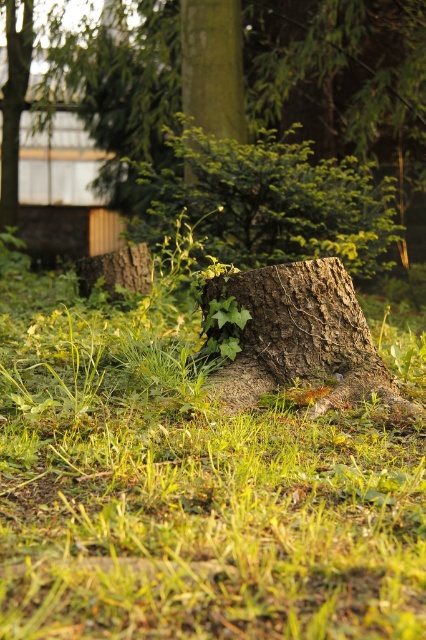
Question: Considering the relative positions of green grass at center and green mossy bark at center in the image provided, where is green grass at center located with respect to green mossy bark at center?

Choices:
 (A) left
 (B) right

Answer: (A)

Question: Which is nearer to the smooth brown stump at center?

Choices:
 (A) green mossy bark at center
 (B) green grass at center

Answer: (A)

Question: Is green grass at center thinner than green mossy bark at center?

Choices:
 (A) no
 (B) yes

Answer: (A)

Question: Considering the real-world distances, which object is closest to the smooth brown stump at center?

Choices:
 (A) green grass at center
 (B) green mossy bark at center

Answer: (B)

Question: Estimate the real-world distances between objects in this image. Which object is farther from the green grass at center?

Choices:
 (A) green mossy bark at center
 (B) smooth brown stump at center

Answer: (B)

Question: From the image, what is the correct spatial relationship of green grass at center in relation to green mossy bark at center?

Choices:
 (A) below
 (B) above

Answer: (A)